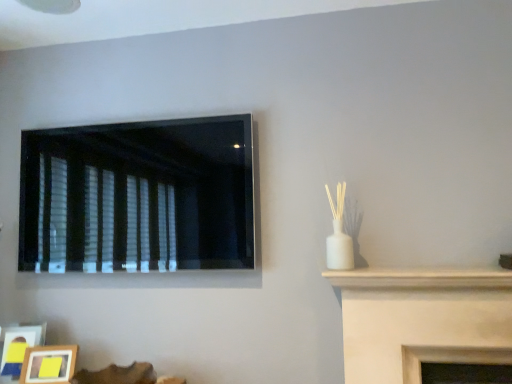
Question: Should I look upward or downward to see wooden picture frame at lower left, the 1th picture frame in the left-to-right sequence?

Choices:
 (A) down
 (B) up

Answer: (A)

Question: Is black matte window at upper left in front of wooden picture frame at lower left, the 1th picture frame in the left-to-right sequence?

Choices:
 (A) yes
 (B) no

Answer: (A)

Question: Is black matte window at upper left facing away from wooden picture frame at lower left, which ranks as the 2th picture frame in right-to-left order?

Choices:
 (A) yes
 (B) no

Answer: (B)

Question: Considering the relative sizes of black matte window at upper left and wooden picture frame at lower left, the 1th picture frame in the left-to-right sequence, in the image provided, is black matte window at upper left bigger than wooden picture frame at lower left, the 1th picture frame in the left-to-right sequence,?

Choices:
 (A) no
 (B) yes

Answer: (B)

Question: Does black matte window at upper left turn towards wooden picture frame at lower left, the 1th picture frame in the left-to-right sequence?

Choices:
 (A) yes
 (B) no

Answer: (B)

Question: Can you confirm if black matte window at upper left is positioned to the right of wooden picture frame at lower left, the 1th picture frame in the left-to-right sequence?

Choices:
 (A) no
 (B) yes

Answer: (B)

Question: Is black matte window at upper left outside wooden picture frame at lower left, which ranks as the 2th picture frame in right-to-left order?

Choices:
 (A) no
 (B) yes

Answer: (B)

Question: Does black matte window at upper left turn towards wooden photo frame at lower left, acting as the 1th picture frame starting from the right?

Choices:
 (A) yes
 (B) no

Answer: (B)

Question: Is black matte window at upper left to the right of wooden photo frame at lower left, acting as the 1th picture frame starting from the right, from the viewer's perspective?

Choices:
 (A) no
 (B) yes

Answer: (B)

Question: Is black matte window at upper left looking in the opposite direction of wooden photo frame at lower left, acting as the 1th picture frame starting from the right?

Choices:
 (A) yes
 (B) no

Answer: (B)

Question: Is wooden photo frame at lower left, acting as the 1th picture frame starting from the right, completely or partially inside black matte window at upper left?

Choices:
 (A) yes
 (B) no

Answer: (B)

Question: Considering the relative sizes of black matte window at upper left and wooden photo frame at lower left, acting as the 1th picture frame starting from the right, in the image provided, is black matte window at upper left wider than wooden photo frame at lower left, acting as the 1th picture frame starting from the right,?

Choices:
 (A) yes
 (B) no

Answer: (B)

Question: From the image's perspective, would you say black matte window at upper left is positioned over wooden photo frame at lower left, acting as the 1th picture frame starting from the right?

Choices:
 (A) no
 (B) yes

Answer: (B)

Question: Is wooden photo frame at lower left, the second picture frame when ordered from left to right, thinner than wooden picture frame at lower left, the 1th picture frame in the left-to-right sequence?

Choices:
 (A) yes
 (B) no

Answer: (A)